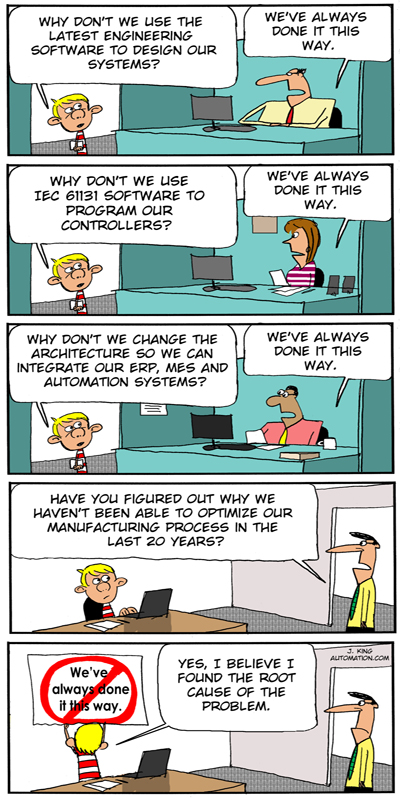
At what (x,y) coordinates should I click in order to perform the action: click on laptop computer. Please return your answer as a coordinate pair (x, y). The image size is (400, 800). Looking at the image, I should click on (155, 757), (152, 593).